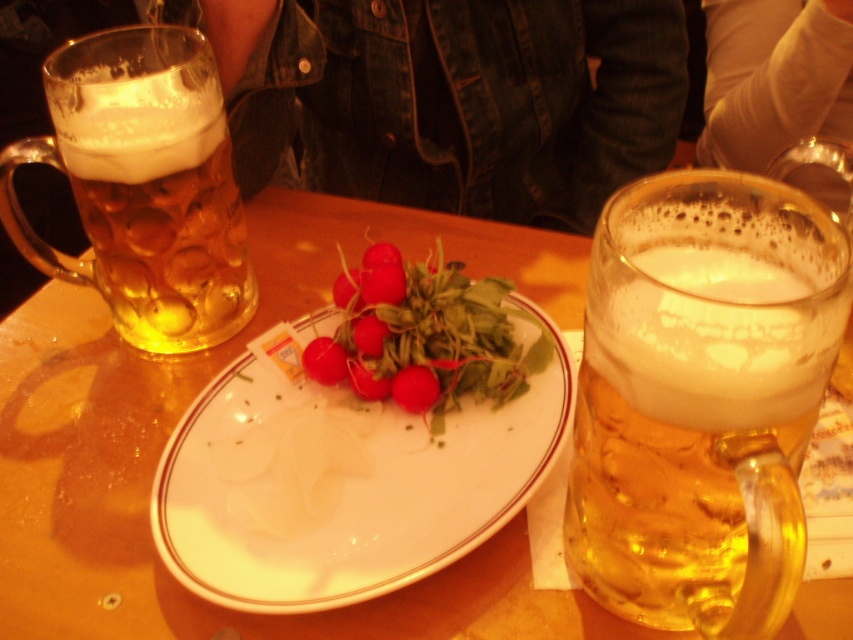
Does wooden table at center appear on the right side of translucent glass mug at left?

Correct, you'll find wooden table at center to the right of translucent glass mug at left.

Between wooden table at center and translucent glass mug at left, which one appears on the right side from the viewer's perspective?

From the viewer's perspective, wooden table at center appears more on the right side.

Does point (85, 596) come farther from viewer compared to point (216, 196)?

No, it is not.

Where is `wooden table at center`? This screenshot has height=640, width=853. wooden table at center is located at coordinates (187, 406).

Between wooden table at center and red matte radish at center, which one has less height?

Standing shorter between the two is red matte radish at center.

At what (x,y) coordinates should I click in order to perform the action: click on wooden table at center. Please return your answer as a coordinate pair (x, y). This screenshot has width=853, height=640. Looking at the image, I should click on (187, 406).

Identify the location of wooden table at center. This screenshot has height=640, width=853. (187, 406).

In the scene shown: Is white ceramic plate at center closer to the viewer compared to red matte radish at center?

Yes.

This screenshot has height=640, width=853. What are the coordinates of `white ceramic plate at center` in the screenshot? It's located at (344, 483).

Who is more distant from viewer, [366,544] or [434,353]?

The point [434,353] is behind.

In order to click on white ceramic plate at center in this screenshot , I will do `click(344, 483)`.